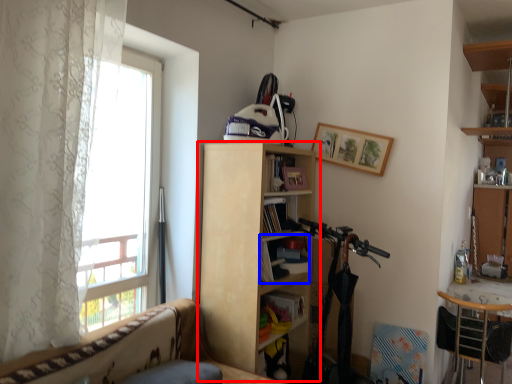
Question: Which of the following is the farthest to the observer, bookcase (highlighted by a red box) or book (highlighted by a blue box)?

Choices:
 (A) bookcase
 (B) book

Answer: (B)